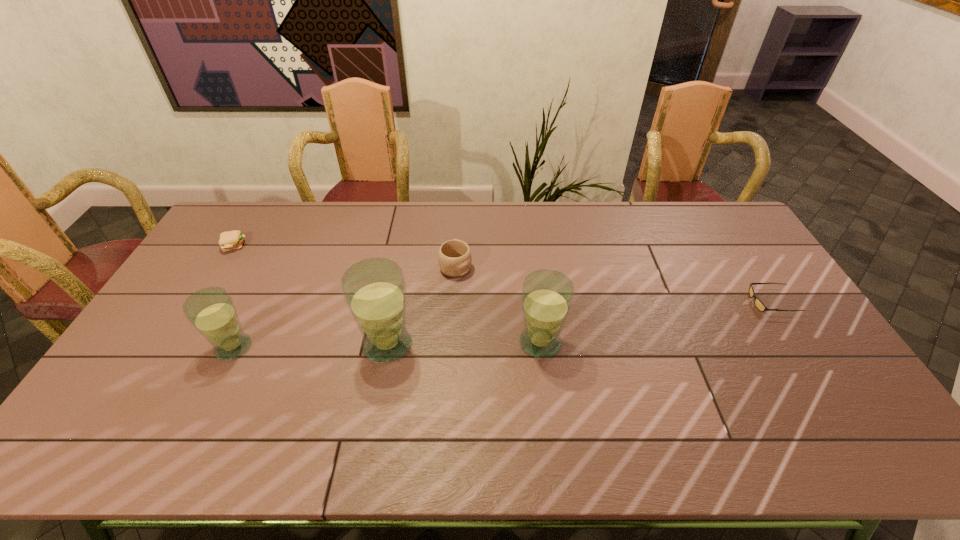
Identify the location of the third shortest object. (454, 257).

This screenshot has width=960, height=540. Find the location of `free spot located on the right of the fifth object from right to left`. free spot located on the right of the fifth object from right to left is located at coordinates (378, 347).

Identify the location of vacant region located on the back of the second glass from left to right. (394, 311).

At what (x,y) coordinates should I click in order to perform the action: click on vacant space located 0.050m on the front of the fifth object from left to right. Please return your answer as a coordinate pair (x, y). Looking at the image, I should click on (544, 377).

Locate an element on the screen. vacant space positioned 0.140m on the front-facing side of the third farthest object is located at coordinates (705, 302).

You are a GUI agent. You are given a task and a screenshot of the screen. Output one action in this format:
    pyautogui.click(x=<x>, y=<y>)
    Task: Click on the blank space located on the front-facing side of the third farthest object
    The width and height of the screenshot is (960, 540).
    Given the screenshot: What is the action you would take?
    pyautogui.click(x=679, y=302)

The width and height of the screenshot is (960, 540). I want to click on vacant space positioned on the front-facing side of the third farthest object, so click(711, 302).

Locate an element on the screen. The width and height of the screenshot is (960, 540). vacant space situated 0.240m on the right of the leftmost object is located at coordinates (314, 246).

Where is `vacant space located on the side of the mug with the handle`? vacant space located on the side of the mug with the handle is located at coordinates (457, 235).

This screenshot has width=960, height=540. In order to click on free region located 0.160m on the side of the mug with the handle in this screenshot , I will do `click(458, 224)`.